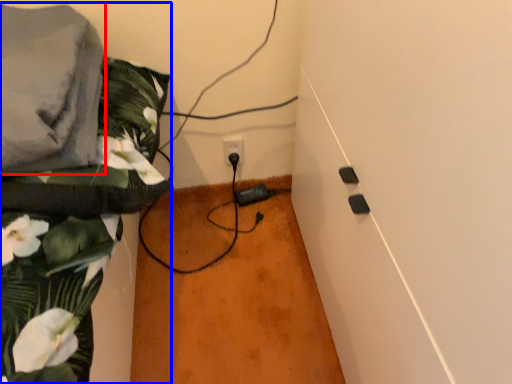
Question: Which object appears farthest to the camera in this image, linen (highlighted by a red box) or textile (highlighted by a blue box)?

Choices:
 (A) linen
 (B) textile

Answer: (B)